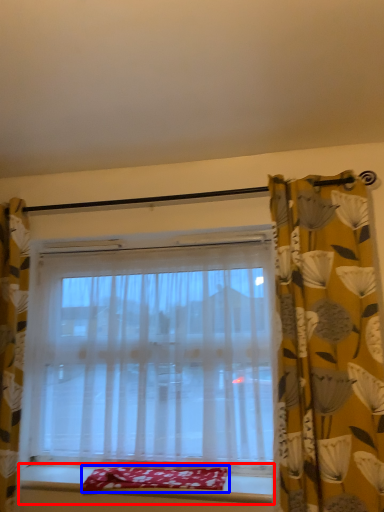
Question: Which point is closer to the camera, window sill (highlighted by a red box) or blanket (highlighted by a blue box)?

Choices:
 (A) window sill
 (B) blanket

Answer: (A)